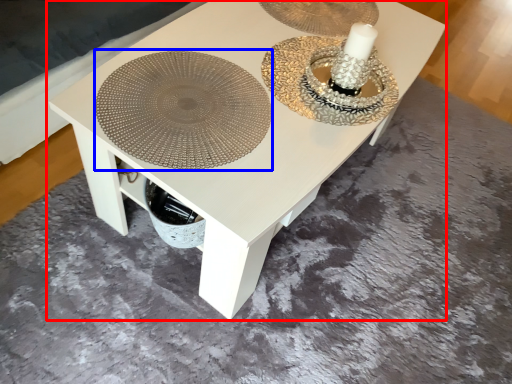
Question: Among these objects, which one is nearest to the camera, table (highlighted by a red box) or platter (highlighted by a blue box)?

Choices:
 (A) table
 (B) platter

Answer: (A)